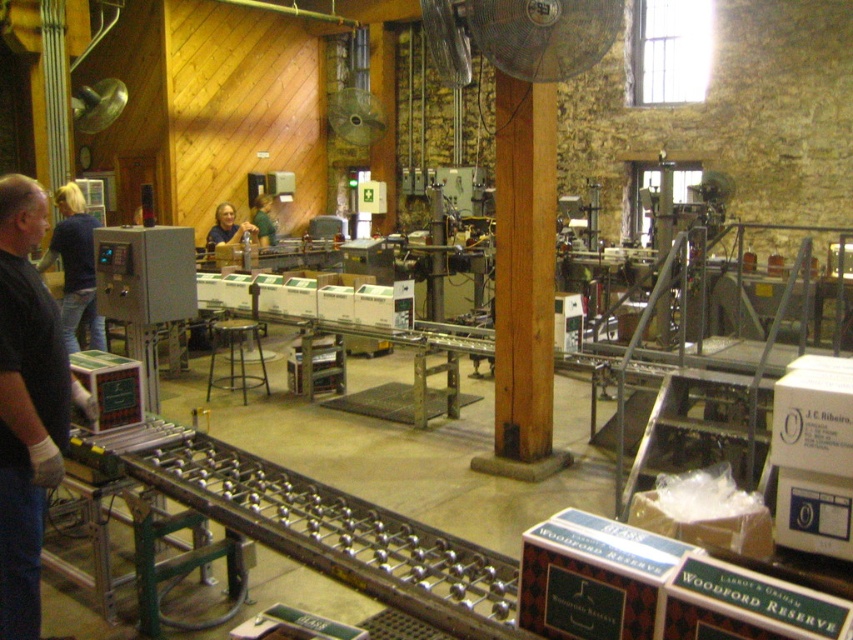
Describe the element at coordinates (74, 268) in the screenshot. I see `blue denim jeans at left` at that location.

Locate an element on the screen. The image size is (853, 640). blue denim jeans at left is located at coordinates (74, 268).

Is point (212, 230) positioned behind point (264, 243)?

No, (212, 230) is in front of (264, 243).

The width and height of the screenshot is (853, 640). Find the location of `matte blue shirt at center`. matte blue shirt at center is located at coordinates (228, 227).

Between blue denim jeans at left and green fabric shirt at center, which one appears on the left side from the viewer's perspective?

From the viewer's perspective, blue denim jeans at left appears more on the left side.

Who is more distant from viewer, (59,225) or (262,237)?

The point (262,237) is behind.

Identify the location of blue denim jeans at left. Image resolution: width=853 pixels, height=640 pixels. (74, 268).